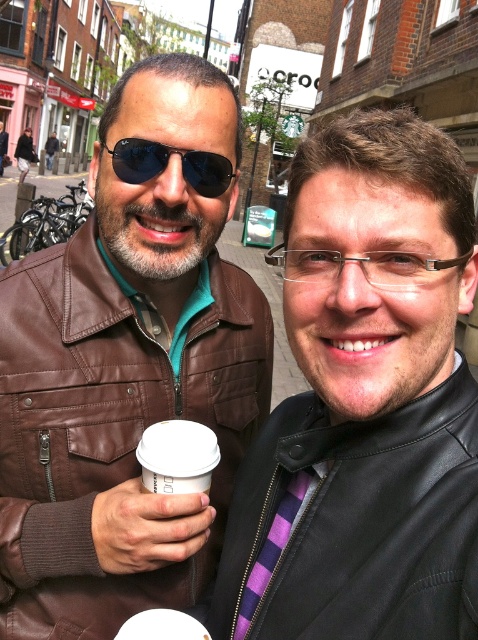
Which of these two, white paper cup at center or matte black sunglasses at upper left, stands taller?

white paper cup at center

Between point (177, 429) and point (224, 188), which one is positioned behind?

Point (224, 188)

The height and width of the screenshot is (640, 478). Describe the element at coordinates (176, 456) in the screenshot. I see `white paper cup at center` at that location.

The width and height of the screenshot is (478, 640). Find the location of `white paper cup at center`. white paper cup at center is located at coordinates (176, 456).

Who is positioned more to the left, brown leather jacket at left or matte black sunglasses at upper left?

brown leather jacket at left is more to the left.

Can you confirm if brown leather jacket at left is positioned to the left of matte black sunglasses at upper left?

Correct, you'll find brown leather jacket at left to the left of matte black sunglasses at upper left.

Between point (174, 115) and point (143, 177), which one is positioned in front?

Point (174, 115)

At what (x,y) coordinates should I click in order to perform the action: click on brown leather jacket at left. Please return your answer as a coordinate pair (x, y). Looking at the image, I should click on 128,365.

Based on the photo, which is more to the right, purple striped tie at center or white paper cup at center?

Positioned to the right is purple striped tie at center.

Consider the image. Is purple striped tie at center behind white paper cup at center?

That is False.

Who is more forward, (x=460, y=182) or (x=167, y=465)?

Point (x=460, y=182) is more forward.

Where is `purple striped tie at center`? The height and width of the screenshot is (640, 478). purple striped tie at center is located at coordinates (365, 403).